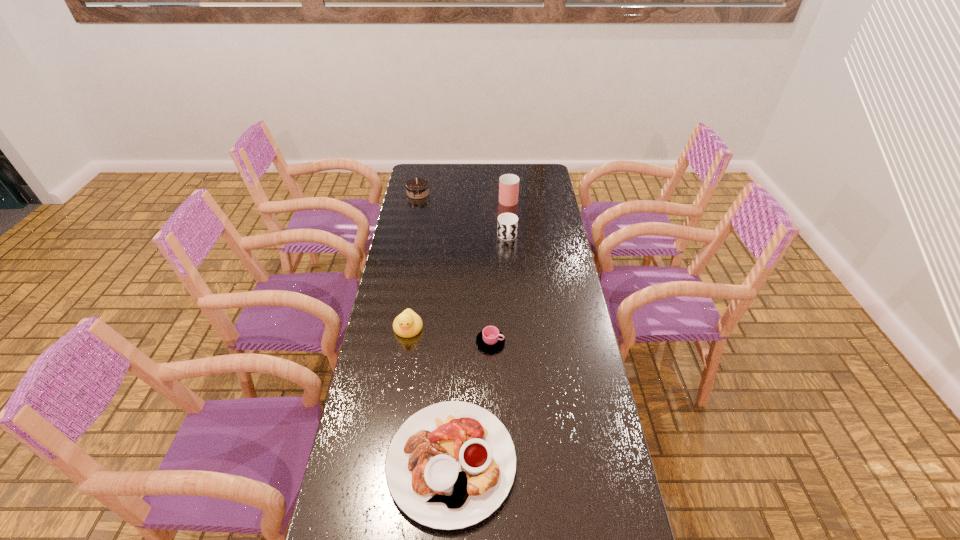
What are the coordinates of `free location located 0.170m on the side of the tallest object with the handle` in the screenshot? It's located at (506, 173).

Where is `free space located on the front of the chocolate cake`? The width and height of the screenshot is (960, 540). free space located on the front of the chocolate cake is located at coordinates (410, 235).

Locate an element on the screen. This screenshot has height=540, width=960. free point located 0.310m on the side of the fourth nearest object with the handle is located at coordinates (512, 298).

Image resolution: width=960 pixels, height=540 pixels. Identify the location of vacant position located 0.170m on the face of the duckling. (399, 384).

In order to click on free region located on the side with the handle of the shortest cup in this screenshot , I will do `click(540, 342)`.

Where is `free space located on the left of the nearest object`? free space located on the left of the nearest object is located at coordinates (353, 462).

Where is `object at the far edge`? The width and height of the screenshot is (960, 540). object at the far edge is located at coordinates (417, 188).

Identify the location of chocolate cake at the left edge. (417, 188).

Where is `duckling that is at the left edge`? duckling that is at the left edge is located at coordinates (408, 324).

Locate an element on the screen. This screenshot has width=960, height=540. platter at the left edge is located at coordinates (x=450, y=465).